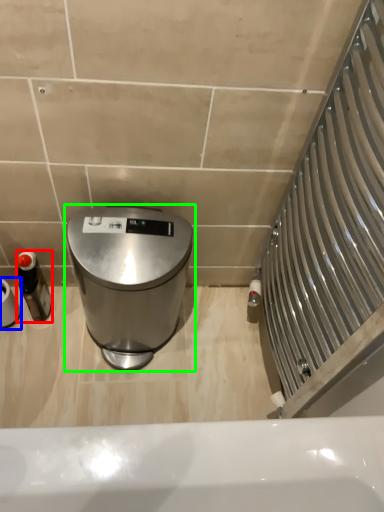
Question: Considering the real-world distances, which object is closest to bottle (highlighted by a red box)? toilet paper (highlighted by a blue box) or waste container (highlighted by a green box).

Choices:
 (A) toilet paper
 (B) waste container

Answer: (A)